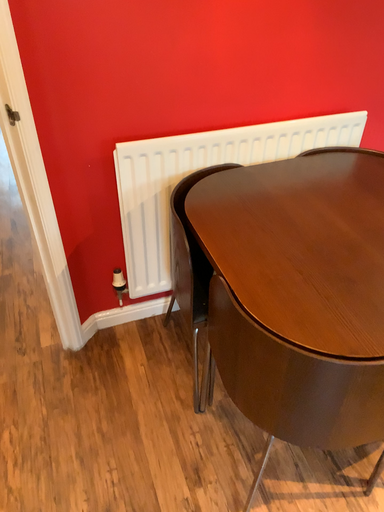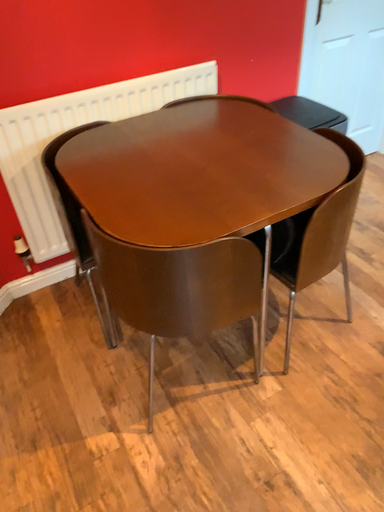
Question: How did the camera likely rotate when shooting the video?

Choices:
 (A) rotated right
 (B) rotated left

Answer: (A)